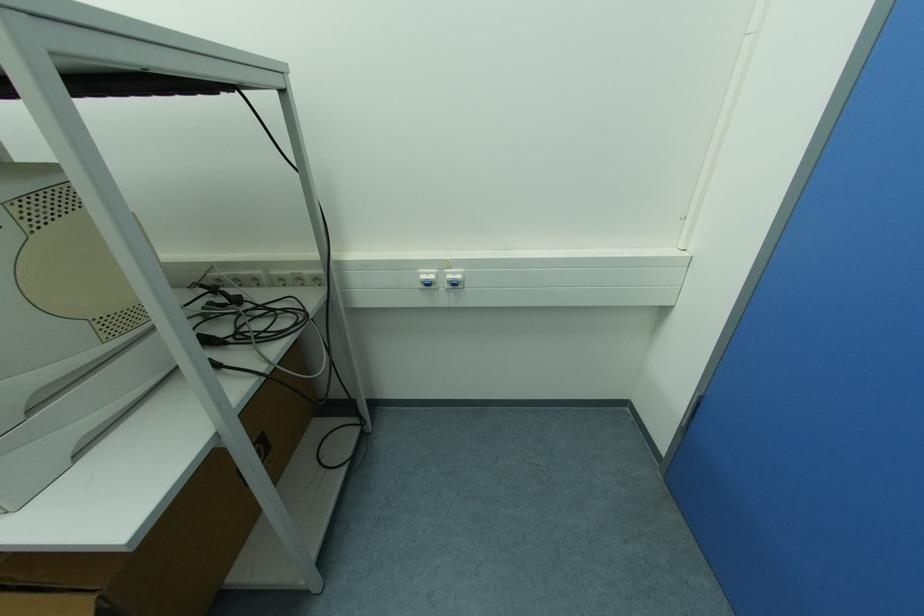
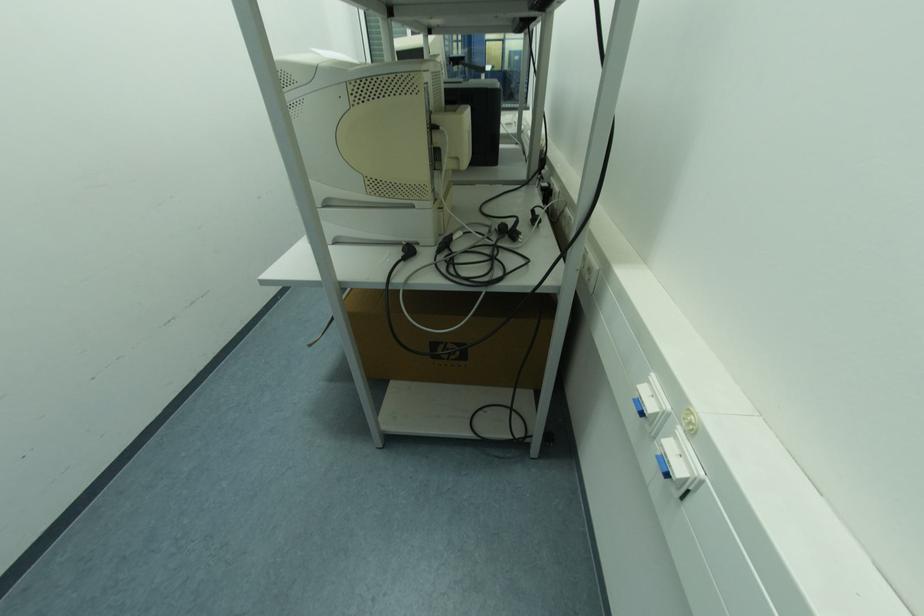
Based on the continuous images, in which direction is the camera rotating?

The rotation direction of the camera is left-down.